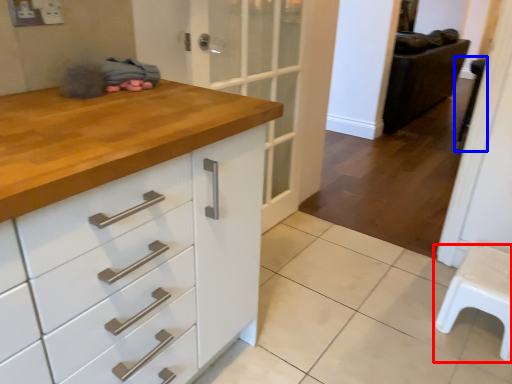
Question: Which of the following is the farthest to the observer, furniture (highlighted by a red box) or step stool (highlighted by a blue box)?

Choices:
 (A) furniture
 (B) step stool

Answer: (B)